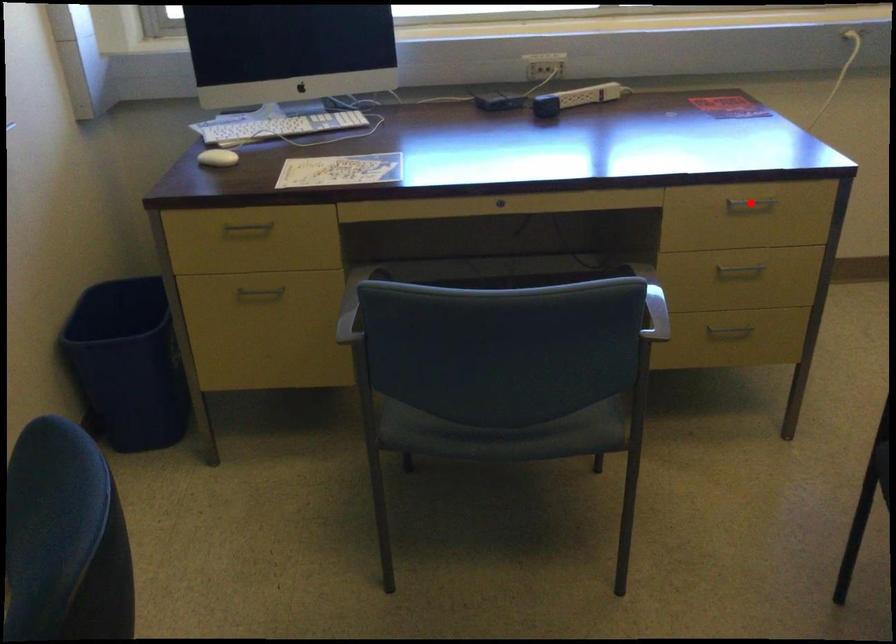
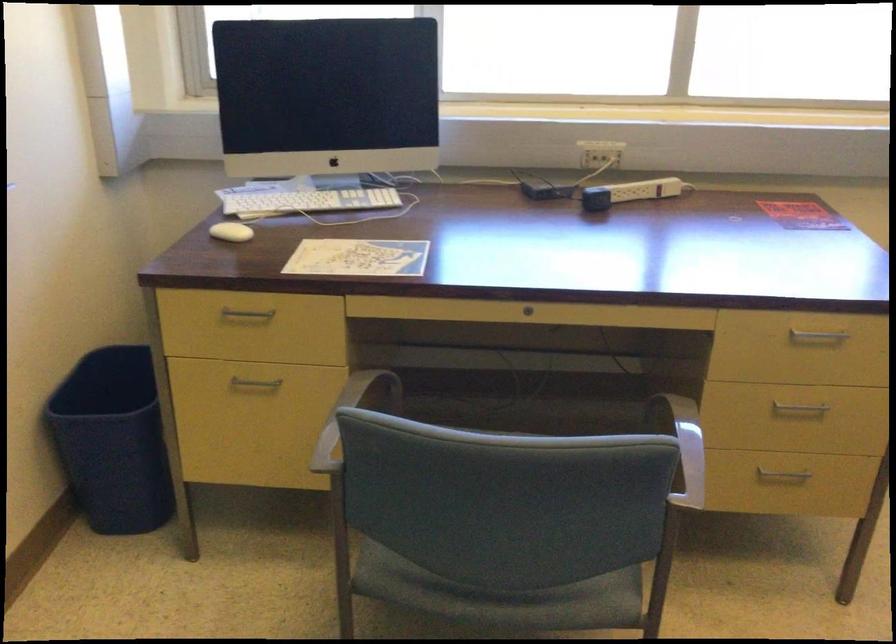
Question: I am providing you with two images of the same scene from different viewpoints. In image1, a red point is highlighted. Considering the same 3D point in image2, which of the following is correct?

Choices:
 (A) It is closer
 (B) It is farther

Answer: (A)